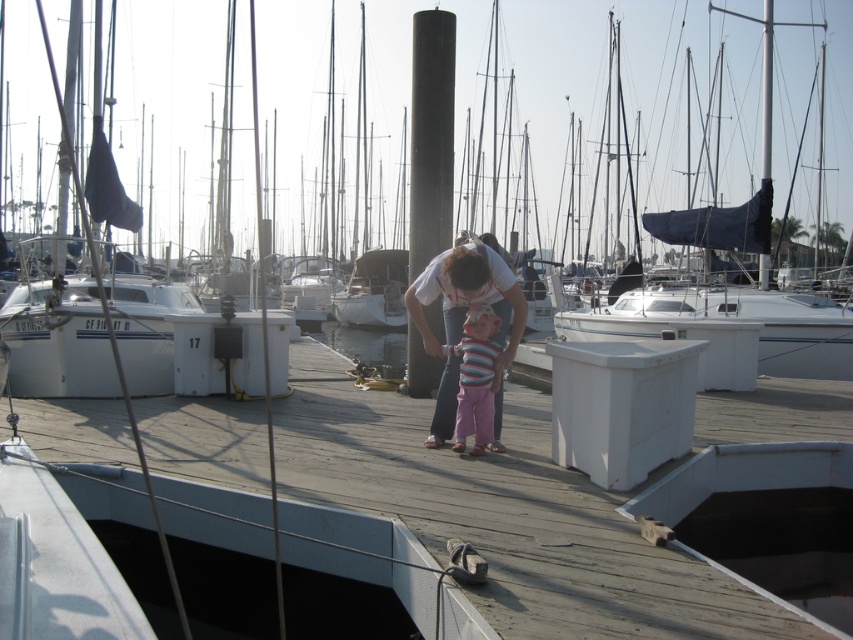
Question: Does white cotton shirt at center come in front of striped fabric at center?

Choices:
 (A) no
 (B) yes

Answer: (B)

Question: Among these points, which one is nearest to the camera?

Choices:
 (A) (498, 374)
 (B) (450, 376)

Answer: (A)

Question: Can you confirm if white cotton shirt at center is positioned below striped fabric at center?

Choices:
 (A) yes
 (B) no

Answer: (B)

Question: Is white cotton shirt at center thinner than striped fabric at center?

Choices:
 (A) no
 (B) yes

Answer: (A)

Question: Which point is farther to the camera?

Choices:
 (A) striped fabric at center
 (B) white cotton shirt at center

Answer: (A)